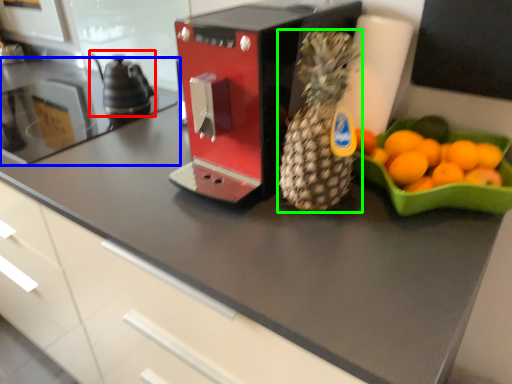
Question: Estimate the real-world distances between objects in this image. Which object is farther from tea pot (highlighted by a red box), countertop (highlighted by a blue box) or pineapple (highlighted by a green box)?

Choices:
 (A) countertop
 (B) pineapple

Answer: (B)